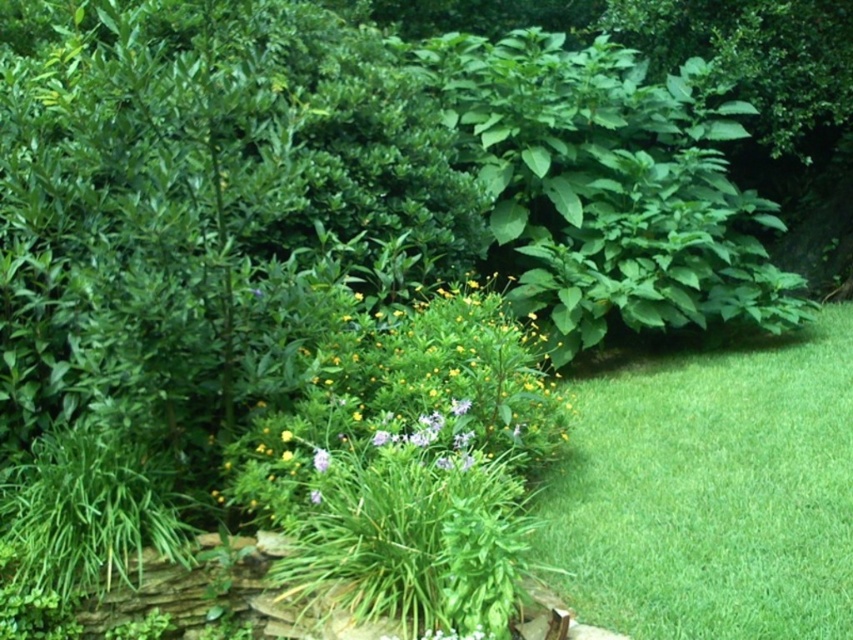
Does green leafy plant at center appear over purple matte flower at center?

Correct, green leafy plant at center is located above purple matte flower at center.

Who is higher up, green leafy plant at center or purple matte flower at center?

green leafy plant at center is above.

Where is `green leafy plant at center`? This screenshot has height=640, width=853. green leafy plant at center is located at coordinates (405, 397).

Who is positioned more to the left, green smooth grass at lower right or green leafy plant at center?

From the viewer's perspective, green leafy plant at center appears more on the left side.

Does green smooth grass at lower right have a greater width compared to green leafy plant at center?

Indeed, green smooth grass at lower right has a greater width compared to green leafy plant at center.

You are a GUI agent. You are given a task and a screenshot of the screen. Output one action in this format:
    pyautogui.click(x=<x>, y=<y>)
    Task: Click on the green smooth grass at lower right
    The width and height of the screenshot is (853, 640).
    Given the screenshot: What is the action you would take?
    pyautogui.click(x=711, y=490)

How distant is green leafy plant at center from yellow matte flower at center?

green leafy plant at center is 19.79 inches from yellow matte flower at center.

The image size is (853, 640). What do you see at coordinates (405, 397) in the screenshot?
I see `green leafy plant at center` at bounding box center [405, 397].

This screenshot has width=853, height=640. I want to click on green leafy plant at center, so click(405, 397).